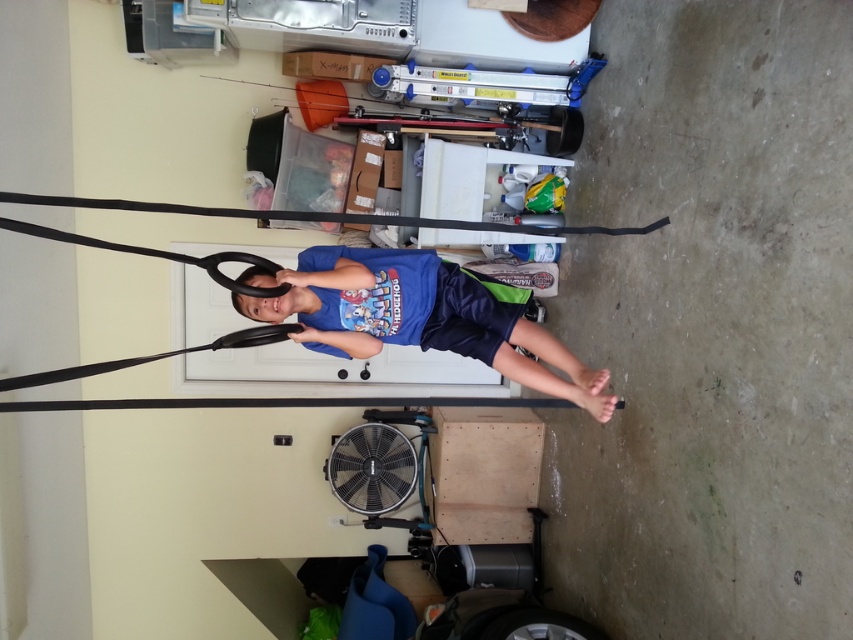
Where is `blue cotton shirt at center`? The width and height of the screenshot is (853, 640). blue cotton shirt at center is located at coordinates (418, 317).

Is blue cotton shirt at center to the right of black rubber tire at lower center from the viewer's perspective?

In fact, blue cotton shirt at center is to the left of black rubber tire at lower center.

Measure the distance between blue cotton shirt at center and camera.

blue cotton shirt at center and camera are 2.42 meters apart from each other.

At what (x,y) coordinates should I click in order to perform the action: click on blue cotton shirt at center. Please return your answer as a coordinate pair (x, y). The image size is (853, 640). Looking at the image, I should click on (418, 317).